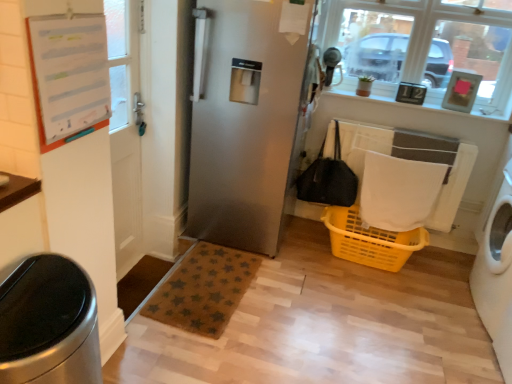
Question: Is brushed metal trash can at lower left in front of white paper at upper left?

Choices:
 (A) yes
 (B) no

Answer: (A)

Question: Is white paper at upper left completely or partially inside brushed metal trash can at lower left?

Choices:
 (A) no
 (B) yes

Answer: (A)

Question: Is brushed metal trash can at lower left facing towards white paper at upper left?

Choices:
 (A) no
 (B) yes

Answer: (A)

Question: From a real-world perspective, does brushed metal trash can at lower left stand above white paper at upper left?

Choices:
 (A) yes
 (B) no

Answer: (B)

Question: Is brushed metal trash can at lower left located outside white paper at upper left?

Choices:
 (A) yes
 (B) no

Answer: (A)

Question: Can you confirm if brushed metal trash can at lower left is wider than white paper at upper left?

Choices:
 (A) yes
 (B) no

Answer: (A)

Question: Would you say white plastic washing machine at right is outside brown textured mat at lower center?

Choices:
 (A) yes
 (B) no

Answer: (A)

Question: Is white plastic washing machine at right shorter than brown textured mat at lower center?

Choices:
 (A) no
 (B) yes

Answer: (A)

Question: Is brown textured mat at lower center at the back of white plastic washing machine at right?

Choices:
 (A) yes
 (B) no

Answer: (B)

Question: Does white plastic washing machine at right have a smaller size compared to brown textured mat at lower center?

Choices:
 (A) yes
 (B) no

Answer: (B)

Question: Is white plastic washing machine at right positioned behind brown textured mat at lower center?

Choices:
 (A) yes
 (B) no

Answer: (B)

Question: Considering the relative sizes of white plastic washing machine at right and brown textured mat at lower center in the image provided, is white plastic washing machine at right bigger than brown textured mat at lower center?

Choices:
 (A) yes
 (B) no

Answer: (A)

Question: Is clear glass window at upper right located within white paper at upper left?

Choices:
 (A) yes
 (B) no

Answer: (B)